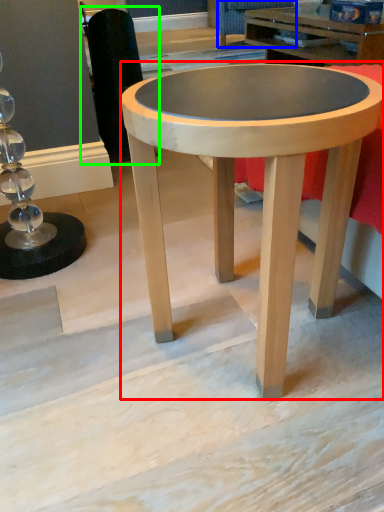
Question: Which is farther away from coffee table (highlighted by a red box)? swivel chair (highlighted by a blue box) or swivel chair (highlighted by a green box)?

Choices:
 (A) swivel chair
 (B) swivel chair

Answer: (A)